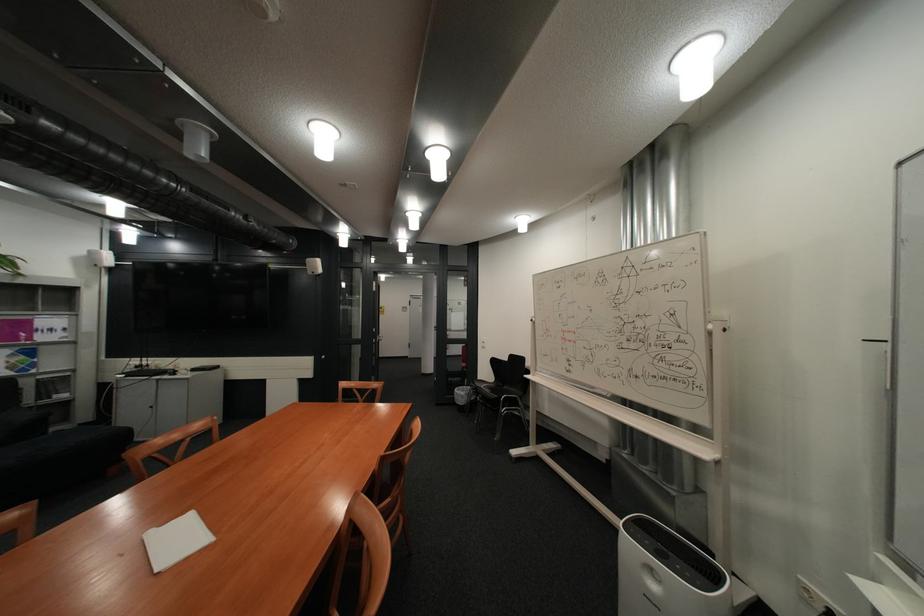
Where would you sit the sofa sitting surface? Please return your answer as a coordinate pair (x, y).

(69, 438)